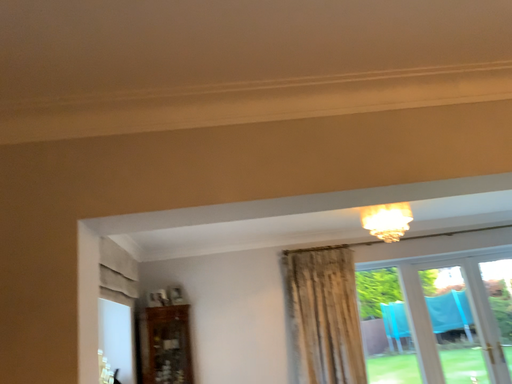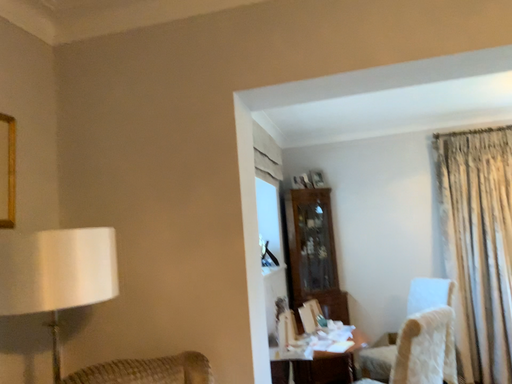
Question: How did the camera likely rotate when shooting the video?

Choices:
 (A) rotated right
 (B) rotated left

Answer: (B)